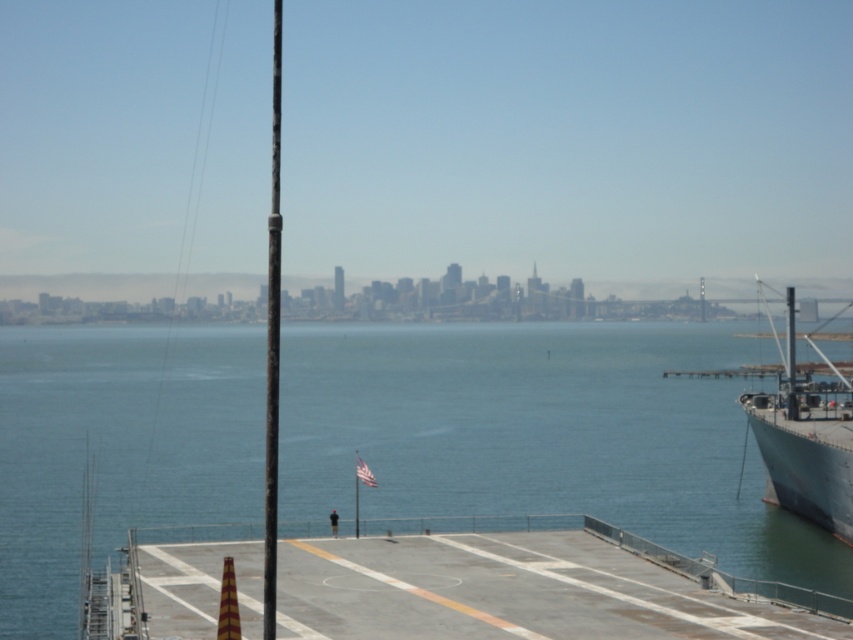
You are standing on the deck of the ship and want to locate the point at coordinates (805, 440). Based on the scene description, where would this point be located relative to the gray metallic ship at right?

The point at coordinates (805, 440) is located on the gray metallic ship at right, as stated in the object description.